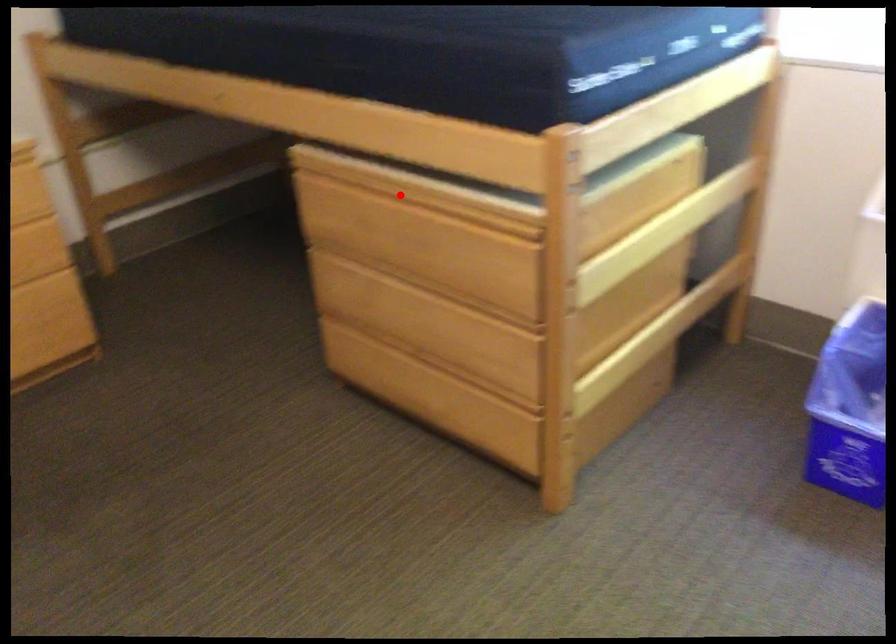
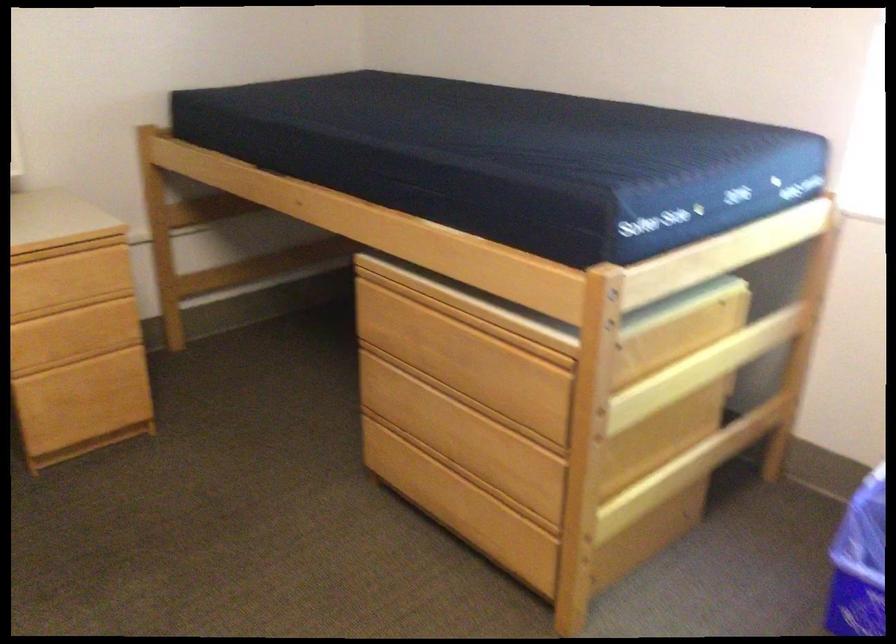
Question: I am providing you with two images of the same scene from different viewpoints. A red point is marked on the first image. Is the red point's position out of view in image 2?

Choices:
 (A) Yes
 (B) No

Answer: (B)